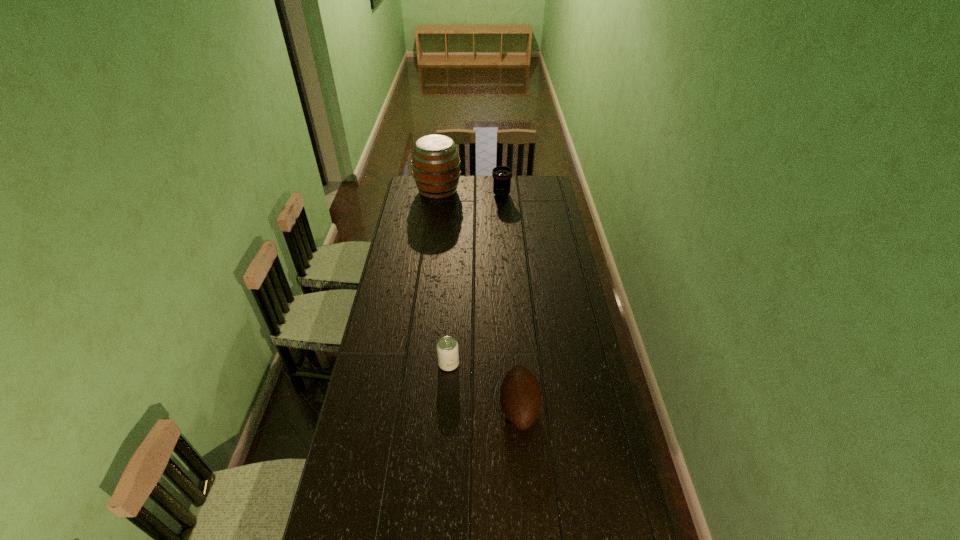
Image resolution: width=960 pixels, height=540 pixels. Identify the location of cider. (436, 166).

Locate an element on the screen. The image size is (960, 540). telephoto lens is located at coordinates (502, 175).

At what (x,y) coordinates should I click in order to perform the action: click on football. Please return your answer as a coordinate pair (x, y). Looking at the image, I should click on (520, 396).

Find the location of `the second nearest object`. the second nearest object is located at coordinates (447, 348).

At what (x,y) coordinates should I click in order to perform the action: click on vacant space positioned 0.160m on the right of the tallest object. Please return your answer as a coordinate pair (x, y). The width and height of the screenshot is (960, 540). Looking at the image, I should click on 488,191.

Image resolution: width=960 pixels, height=540 pixels. Find the location of `vacant space located 0.070m on the front of the telephoto lens`. vacant space located 0.070m on the front of the telephoto lens is located at coordinates (502, 206).

The width and height of the screenshot is (960, 540). What are the coordinates of `free spot located 0.310m on the laces of the football` in the screenshot? It's located at (414, 408).

Where is `vacant space located on the laces of the football`? Image resolution: width=960 pixels, height=540 pixels. vacant space located on the laces of the football is located at coordinates (x=461, y=408).

Find the location of a particular element. Image resolution: width=960 pixels, height=540 pixels. vacant space located on the laces of the football is located at coordinates (464, 408).

The height and width of the screenshot is (540, 960). What are the coordinates of `vacant region located 0.290m on the back of the soda can` in the screenshot? It's located at pos(452,304).